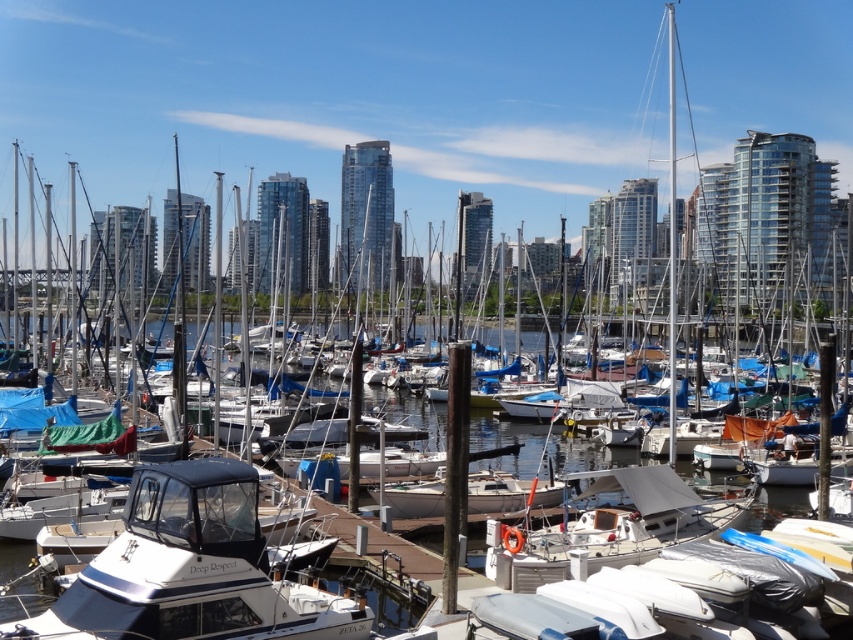
Question: Is clear water at center smaller than white matte sailboat at center?

Choices:
 (A) yes
 (B) no

Answer: (B)

Question: Which of the following is the closest to the observer?

Choices:
 (A) clear water at center
 (B) white glossy boat at center
 (C) white matte sailboat at center
 (D) white matte boat at center

Answer: (A)

Question: Which of the following is the closest to the observer?

Choices:
 (A) clear water at center
 (B) white matte boat at center
 (C) white matte sailboat at center
 (D) white glossy boat at center

Answer: (A)

Question: Is clear water at center smaller than white glossy boat at center?

Choices:
 (A) yes
 (B) no

Answer: (B)

Question: Is white glossy boat at center wider than white matte sailboat at center?

Choices:
 (A) no
 (B) yes

Answer: (A)

Question: Which is nearer to the white matte sailboat at center?

Choices:
 (A) clear water at center
 (B) white glossy boat at center

Answer: (A)